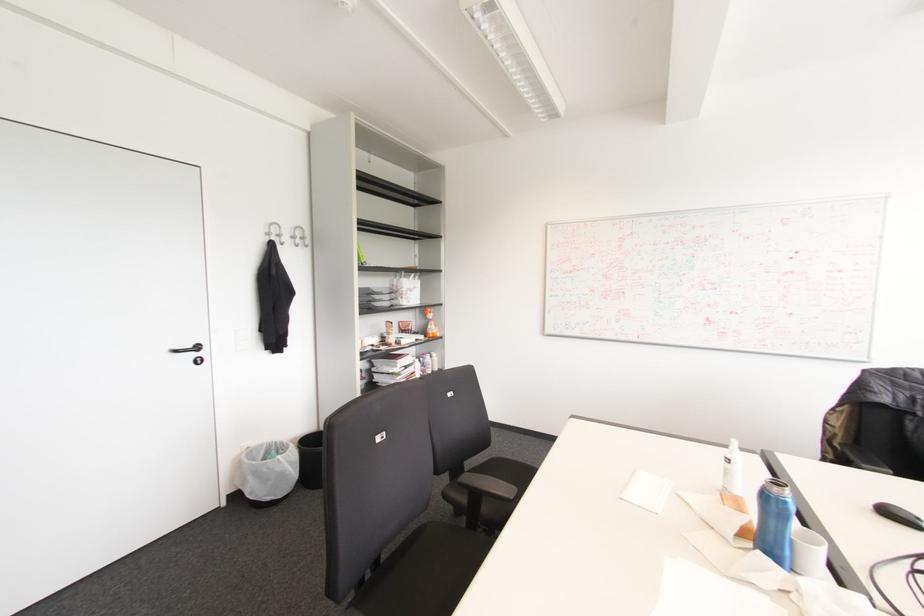
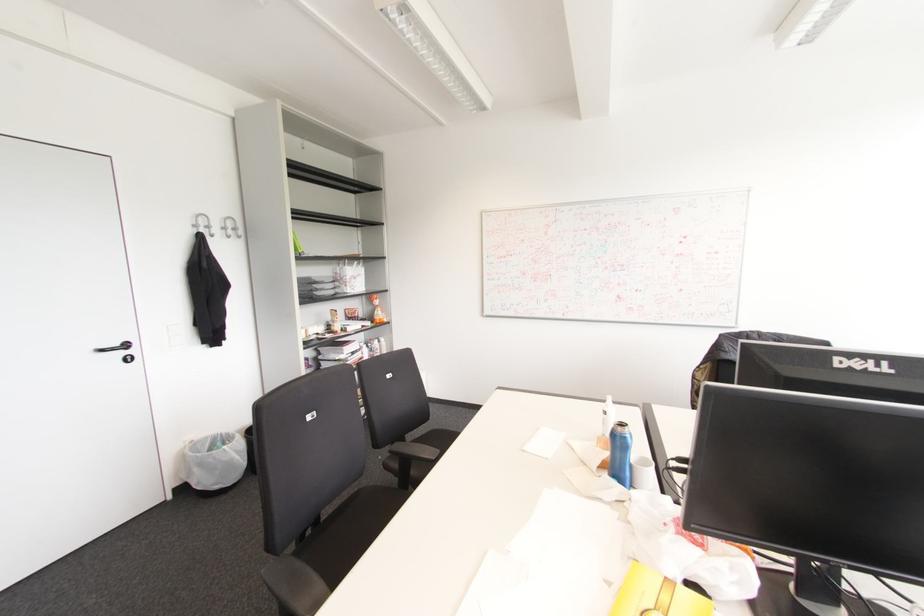
Find the pixel in the second image that matches [727,460] in the first image.

(604, 411)